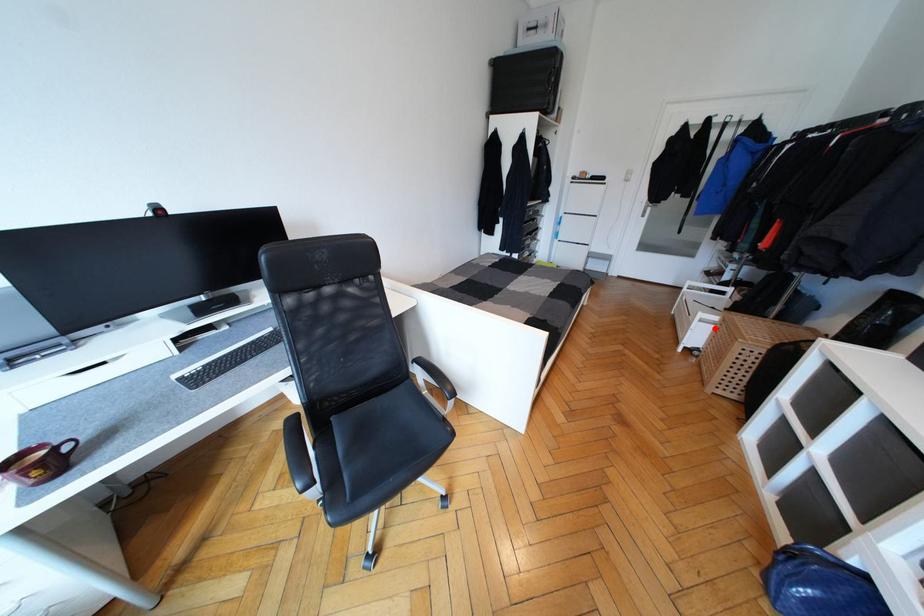
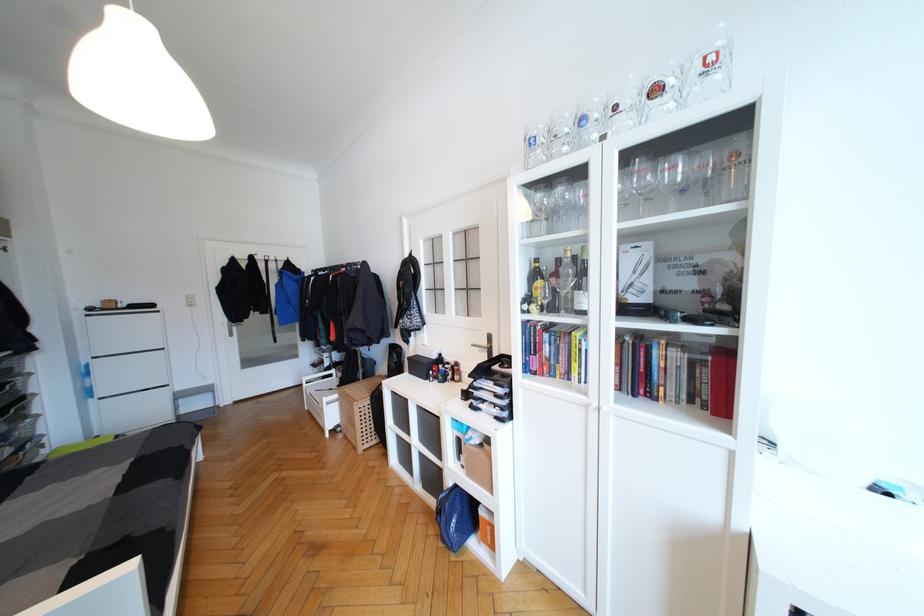
The point at the highlighted location is marked in the first image. Where is the corresponding point in the second image?

(339, 405)